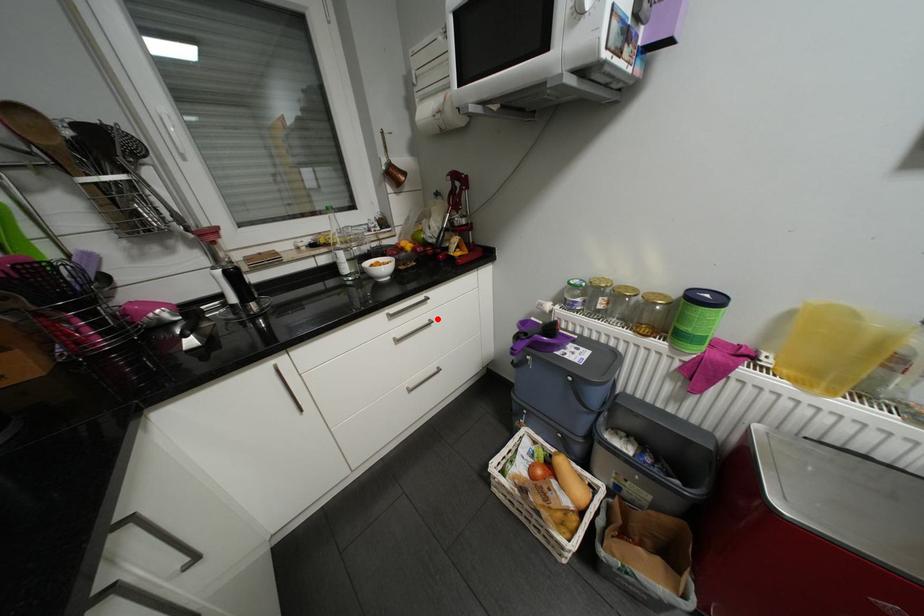
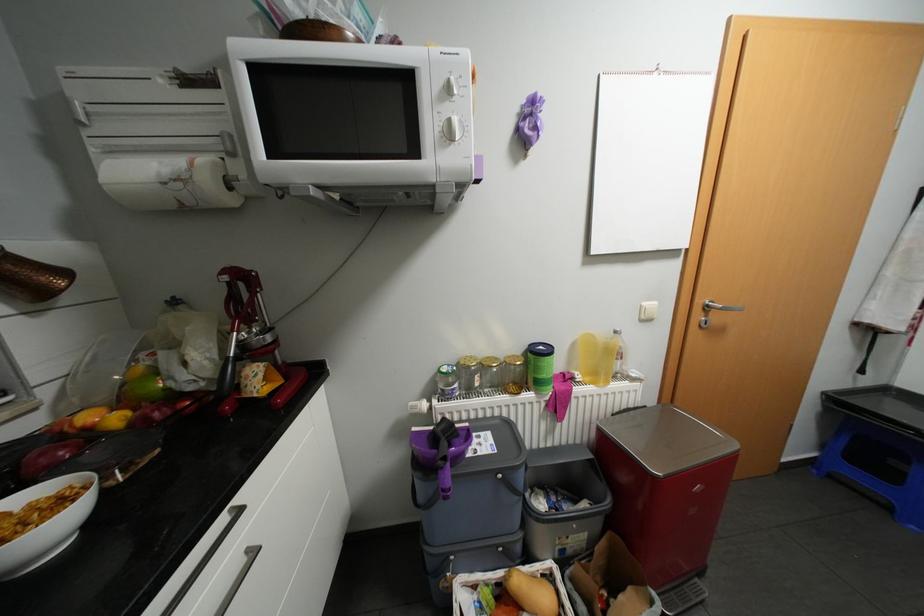
In the second image, find the point that corresponds to the highlighted location in the first image.

(256, 549)